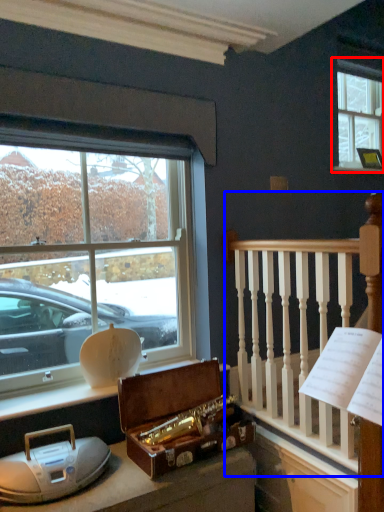
Question: Which point is further to the camera, window (highlighted by a red box) or rail (highlighted by a blue box)?

Choices:
 (A) window
 (B) rail

Answer: (A)